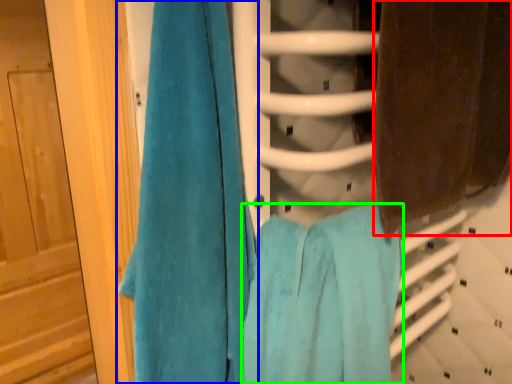
Question: Which is nearer to the towel (highlighted by a red box)? towel (highlighted by a blue box) or towel (highlighted by a green box).

Choices:
 (A) towel
 (B) towel

Answer: (B)